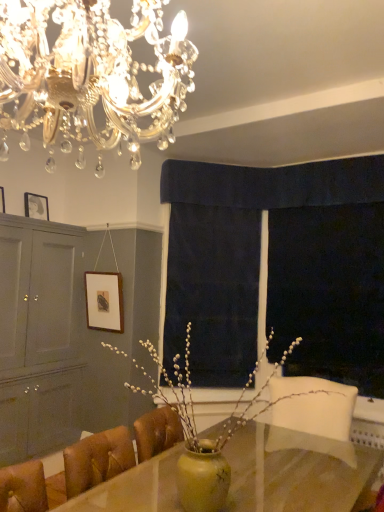
Question: Visually, is yellow matte vase at center positioned to the left or to the right of crystal chandelier at upper center?

Choices:
 (A) right
 (B) left

Answer: (A)

Question: Considering the positions of point (188, 394) and point (49, 122), is point (188, 394) closer or farther from the camera than point (49, 122)?

Choices:
 (A) closer
 (B) farther

Answer: (B)

Question: Estimate the real-world distances between objects in this image. Which object is farther from the matte gray cabinet at left?

Choices:
 (A) wooden picture frame at upper left, positioned as the 1th picture frame in left-to-right order
 (B) matte black picture frame at upper left, the 2th picture frame from the bottom
 (C) yellow matte vase at center
 (D) dark blue velvet curtain at center, the 1th curtain when ordered from bottom to top
 (E) crystal chandelier at upper center

Answer: (E)

Question: Estimate the real-world distances between objects in this image. Which object is closer to the transparent plastic screen at right?

Choices:
 (A) crystal chandelier at upper center
 (B) yellow glossy vase at center
 (C) dark blue velvet curtain at upper center, the 2th curtain viewed from the left
 (D) yellow matte vase at center
 (E) dark blue velvet curtain at center, the second curtain positioned from the right

Answer: (E)